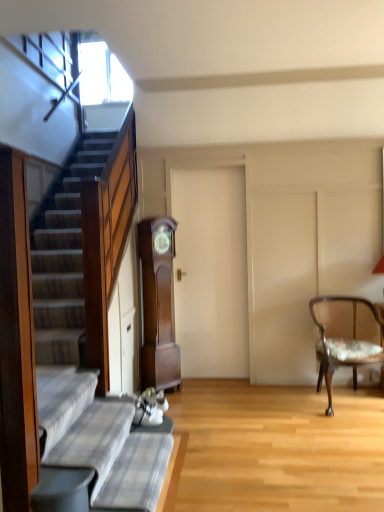
Where is `vacant region to the left of wooden cane chair with floral cushion at right`? vacant region to the left of wooden cane chair with floral cushion at right is located at coordinates (274, 402).